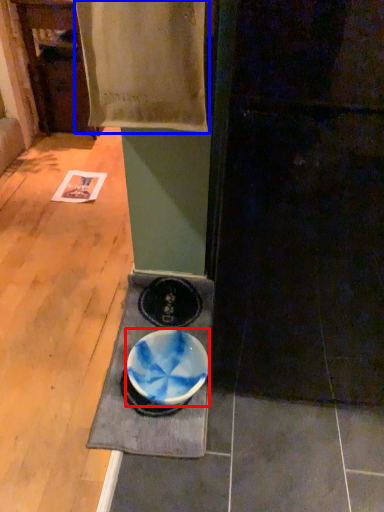
Question: Among these objects, which one is nearest to the camera, bowl (highlighted by a red box) or blanket (highlighted by a blue box)?

Choices:
 (A) bowl
 (B) blanket

Answer: (B)